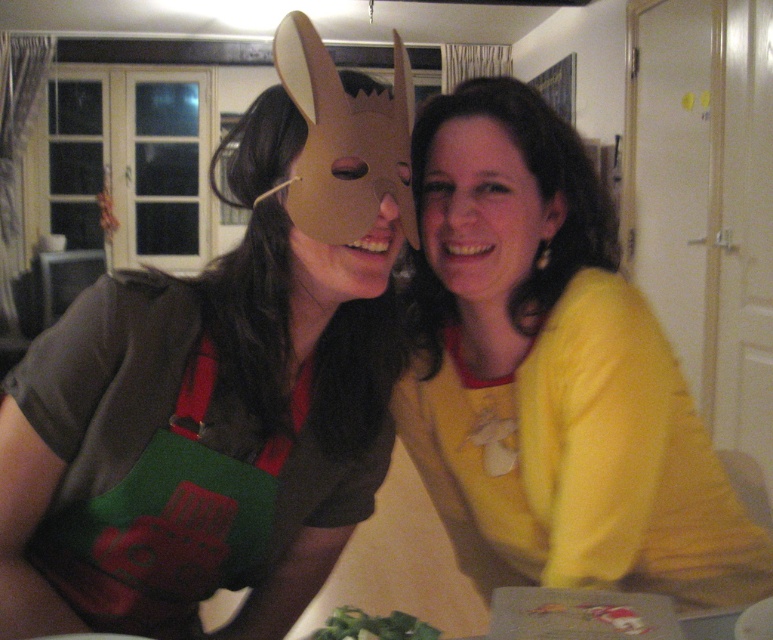
Looking at this image, you are a tailor measuring fabrics for alterations. You need to determine which item requires more fabric to cover its width between the matte yellow shirt at center and the matte cardboard mask at center. Which one needs more fabric?

The matte yellow shirt at center requires more fabric to cover its width because its width surpasses that of the matte cardboard mask at center.

You are a photographer trying to capture a clear shot of both the matte yellow shirt at center and the matte cardboard mask at center. Since the camera can only focus on one object at a time, which object should you focus on first to ensure the other is still somewhat in focus?

The matte yellow shirt at center is below the matte cardboard mask at center, so focusing on the matte cardboard mask at center first would keep the matte yellow shirt at center in the background, allowing it to remain somewhat in focus.